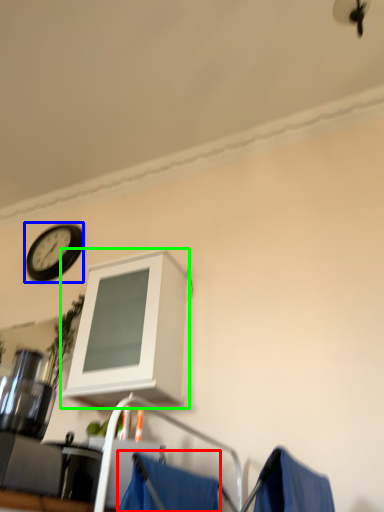
Question: Which object is positioned farthest from curtain (highlighted by a red box)? Select from wall clock (highlighted by a blue box) and cabinetry (highlighted by a green box).

Choices:
 (A) wall clock
 (B) cabinetry

Answer: (A)